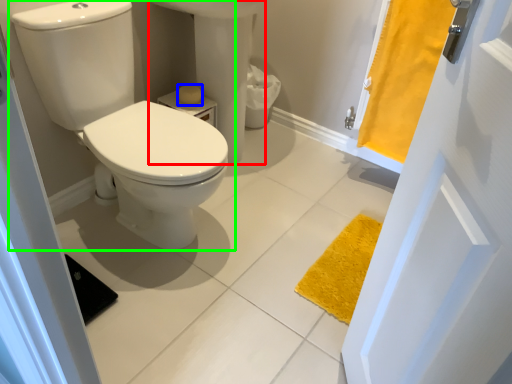
Question: Which object is positioned closest to sink (highlighted by a red box)? Select from toilet paper (highlighted by a blue box) and toilet (highlighted by a green box).

Choices:
 (A) toilet paper
 (B) toilet

Answer: (A)